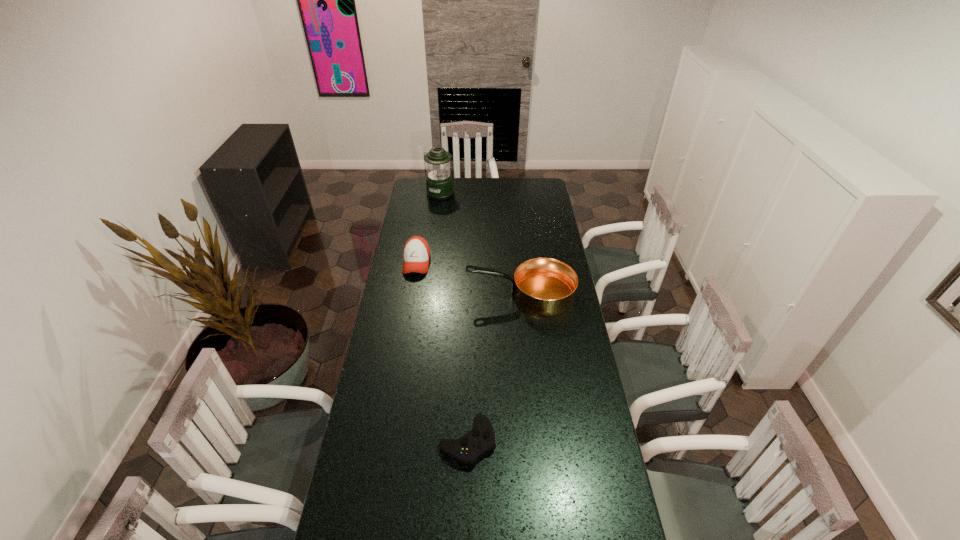
Where is `free spot located on the front-facing side of the baseball cap`? The width and height of the screenshot is (960, 540). free spot located on the front-facing side of the baseball cap is located at coordinates (411, 300).

At what (x,y) coordinates should I click in order to perform the action: click on free space located on the front of the nearest object. Please return your answer as a coordinate pair (x, y). The image size is (960, 540). Looking at the image, I should click on (466, 538).

Identify the location of object that is at the far edge. (439, 182).

Locate an element on the screen. The image size is (960, 540). lantern present at the left edge is located at coordinates (439, 182).

Identify the location of baseball cap present at the left edge. (416, 253).

The height and width of the screenshot is (540, 960). Identify the location of object present at the right edge. (543, 286).

This screenshot has width=960, height=540. Identify the location of object at the far left corner. (439, 182).

Where is `free space at the far edge of the desktop`? The width and height of the screenshot is (960, 540). free space at the far edge of the desktop is located at coordinates tap(519, 178).

Locate an element on the screen. blank space at the left edge is located at coordinates (362, 525).

Find the location of a particular element. vacant area at the right edge of the desktop is located at coordinates click(527, 215).